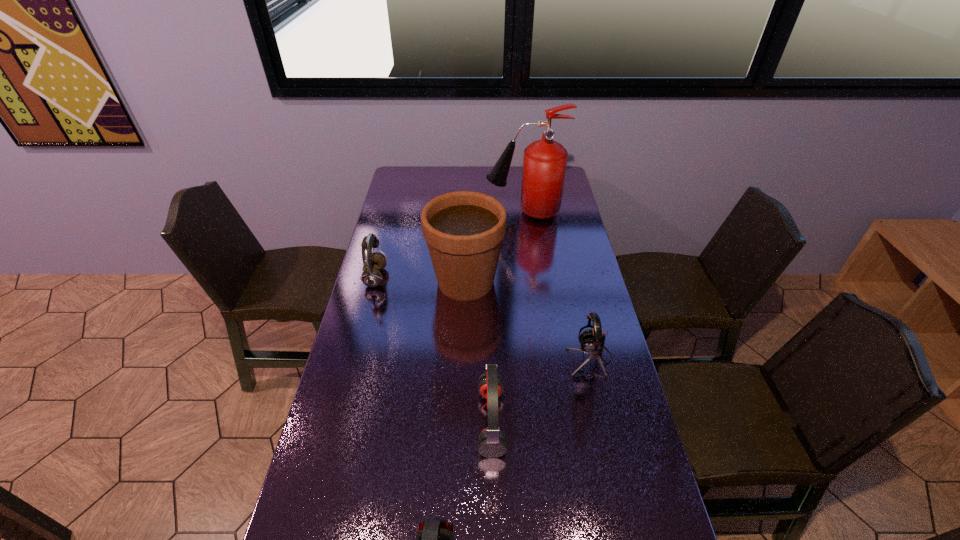
Image resolution: width=960 pixels, height=540 pixels. What are the coordinates of `vacant space situated with the nozzle aimed from the fire extinguisher` in the screenshot? It's located at (429, 212).

In order to click on blank area located with the nozzle aimed from the fire extinguisher in this screenshot , I will do `click(472, 212)`.

Find the location of a particular element. Image resolution: width=960 pixels, height=540 pixels. vacant area located 0.230m on the right of the fifth shortest object is located at coordinates (567, 281).

Locate an element on the screen. free space located on the ear pads of the farthest earphone is located at coordinates (411, 278).

You are a GUI agent. You are given a task and a screenshot of the screen. Output one action in this format:
    pyautogui.click(x=<x>, y=<y>)
    Task: Click on the vacant space located 0.070m on the left of the second farthest earphone
    
    Given the screenshot: What is the action you would take?
    pyautogui.click(x=543, y=358)

You are a GUI agent. You are given a task and a screenshot of the screen. Output one action in this format:
    pyautogui.click(x=<x>, y=<y>)
    Task: Click on the vacant space situated on the ear cups of the third earphone from left to right
    The height and width of the screenshot is (540, 960).
    Given the screenshot: What is the action you would take?
    pyautogui.click(x=348, y=421)

Locate an element on the screen. The image size is (960, 540). vacant region located 0.380m on the ear cups of the third earphone from left to right is located at coordinates (337, 421).

Find the location of a particular element. The image size is (960, 540). free space located 0.270m on the ear cups of the third earphone from left to right is located at coordinates (377, 421).

Find the location of `object located in the left edge section of the desktop`. object located in the left edge section of the desktop is located at coordinates (373, 262).

Find the location of a particular element. Image resolution: width=960 pixels, height=540 pixels. fire extinguisher at the right edge is located at coordinates (544, 165).